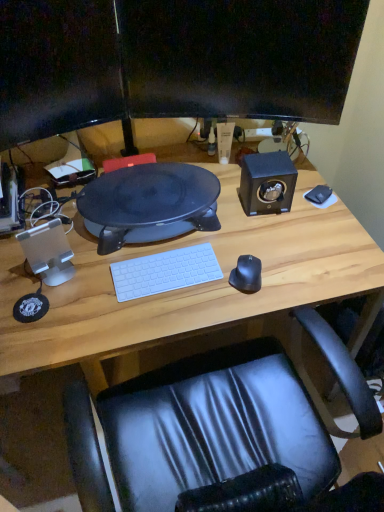
Find the location of a particular element. free space that is to the left of black matte mousepad at right is located at coordinates (259, 210).